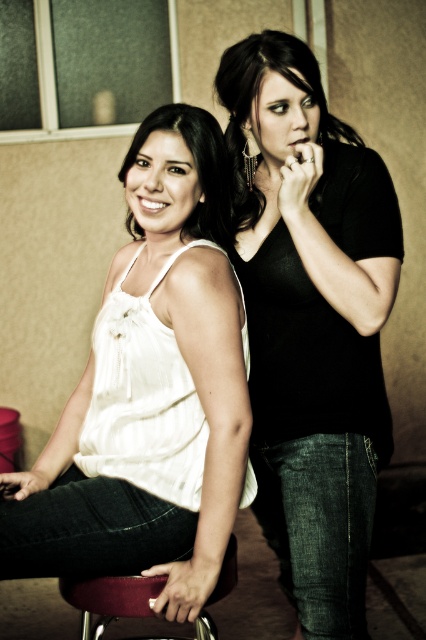
Is black matte shirt at center in front of velvet maroon bar stool at lower center?

No, it is behind velvet maroon bar stool at lower center.

What do you see at coordinates (311, 323) in the screenshot? I see `black matte shirt at center` at bounding box center [311, 323].

Image resolution: width=426 pixels, height=640 pixels. In order to click on black matte shirt at center in this screenshot , I will do `click(311, 323)`.

Between point (316, 200) and point (224, 307), which one is positioned behind?

Point (316, 200)

Where is `black matte shirt at center`? The height and width of the screenshot is (640, 426). black matte shirt at center is located at coordinates (311, 323).

Does matte black shirt at upper right have a lesser height compared to velvet maroon bar stool at lower center?

No.

In the scene shown: Is matte black shirt at upper right to the right of velvet maroon bar stool at lower center from the viewer's perspective?

Yes, matte black shirt at upper right is to the right of velvet maroon bar stool at lower center.

Which is behind, point (359, 138) or point (221, 588)?

The point (359, 138) is behind.

The image size is (426, 640). In order to click on matte black shirt at upper right in this screenshot , I will do `click(256, 104)`.